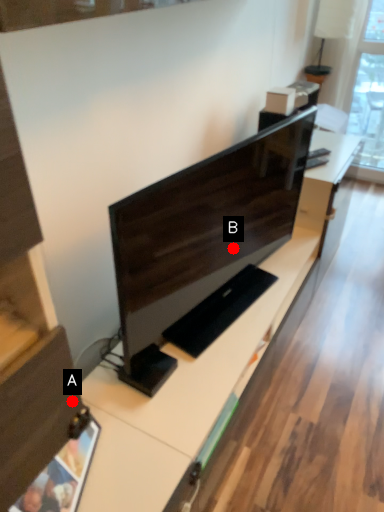
Question: Two points are circled on the image, labeled by A and B beside each circle. Which point is farther from the camera taking this photo?

Choices:
 (A) A is further
 (B) B is further

Answer: (B)